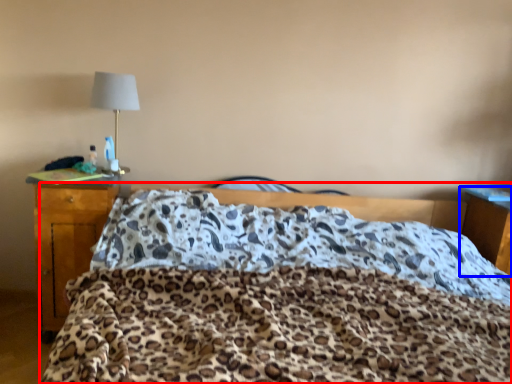
Question: Which object is further to the camera taking this photo, bed (highlighted by a red box) or nightstand (highlighted by a blue box)?

Choices:
 (A) bed
 (B) nightstand

Answer: (B)